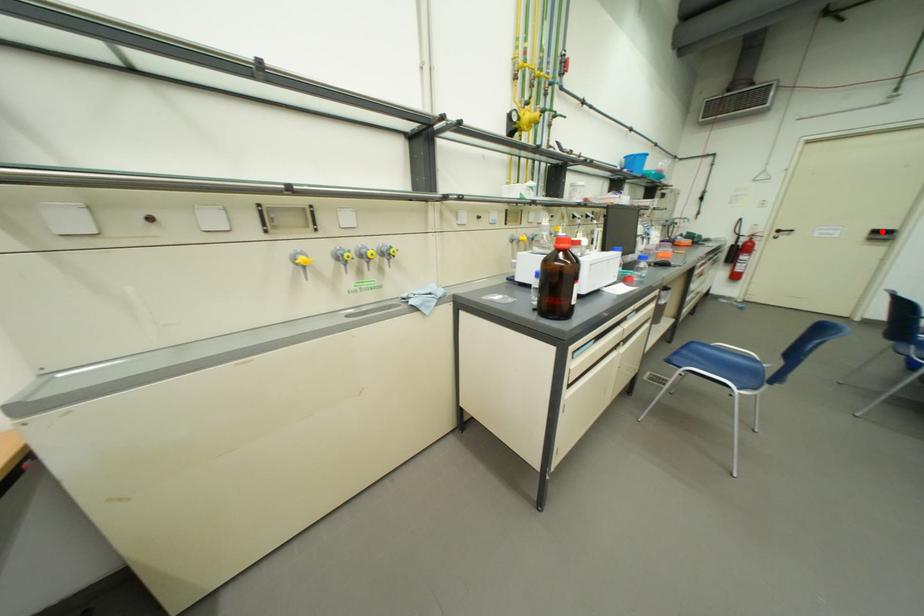
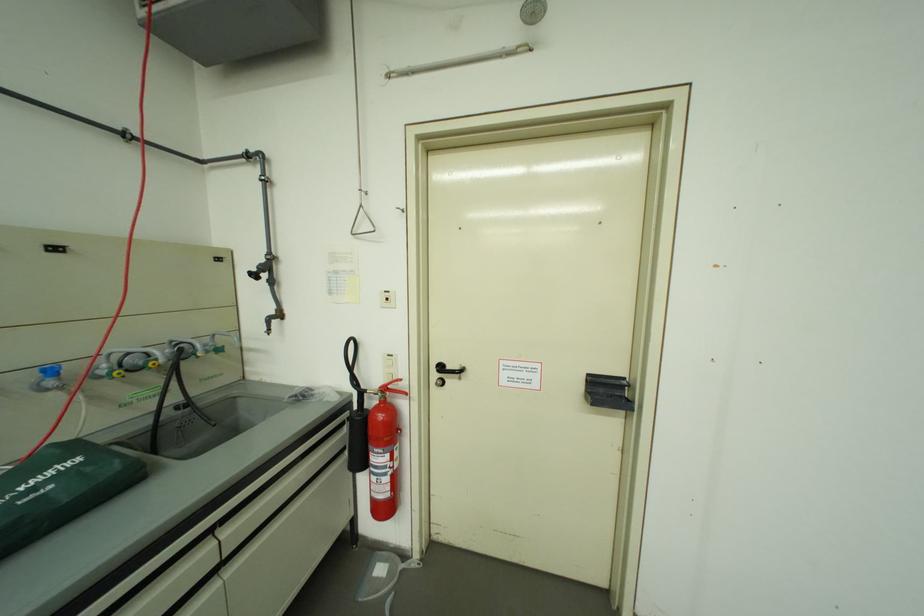
The point at the highlighted location is marked in the first image. Where is the corresponding point in the second image?

(598, 377)